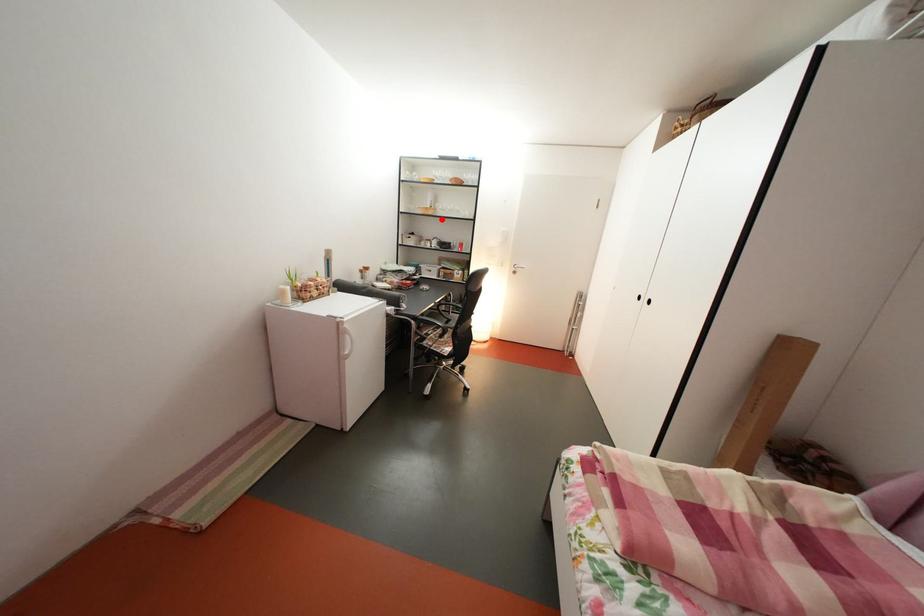
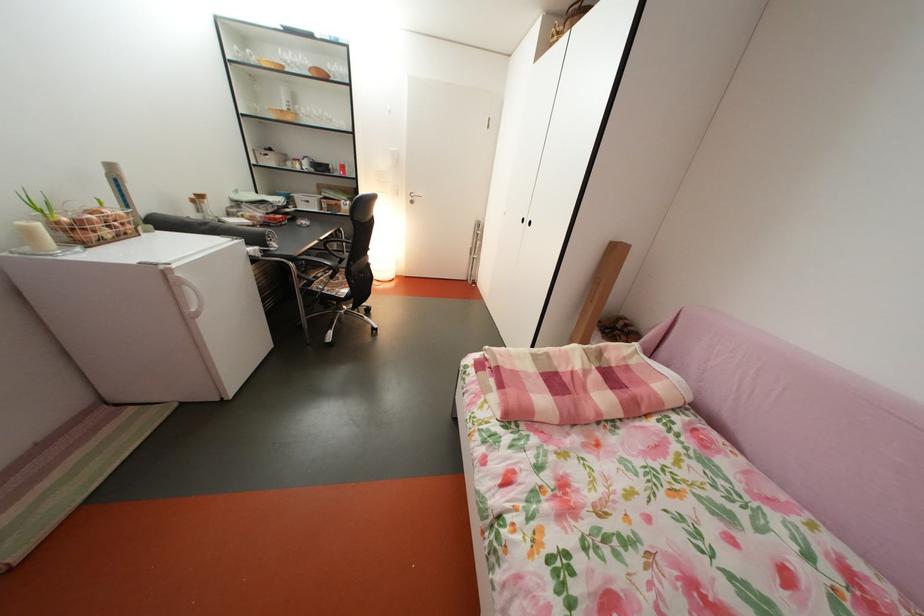
Where in the second image is the point corresponding to the highlighted location from the first image?

(300, 124)